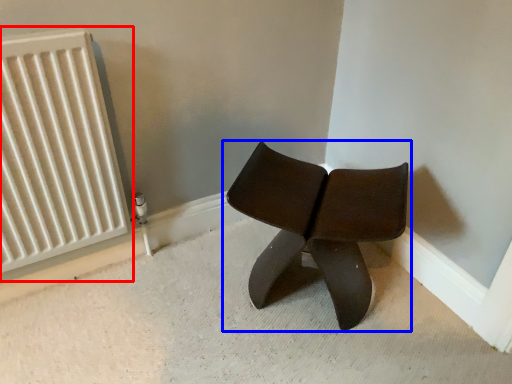
Question: Which of the following is the closest to the observer, radiator (highlighted by a red box) or chair (highlighted by a blue box)?

Choices:
 (A) radiator
 (B) chair

Answer: (A)